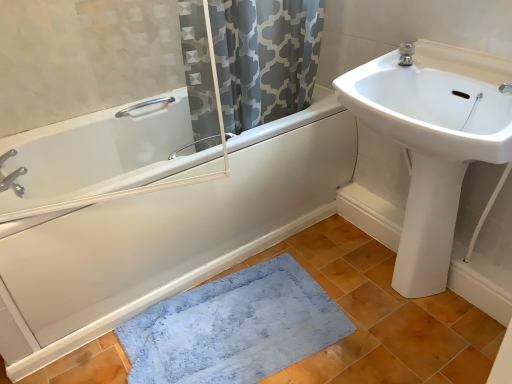
Where is `vacant area that is in front of white glossy bidet at right`? This screenshot has width=512, height=384. vacant area that is in front of white glossy bidet at right is located at coordinates (426, 325).